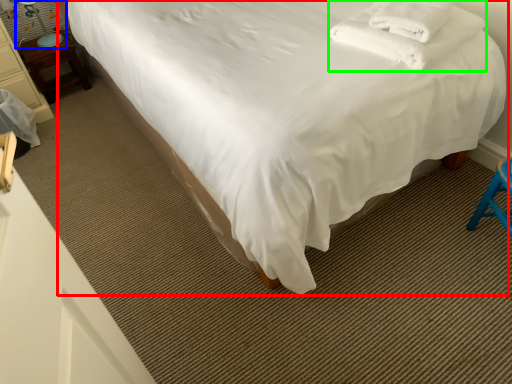
Question: Which is nearer to the bed (highlighted by a red box)? table lamp (highlighted by a blue box) or blanket (highlighted by a green box).

Choices:
 (A) table lamp
 (B) blanket

Answer: (B)